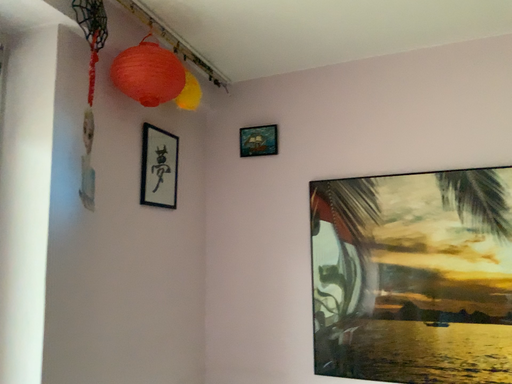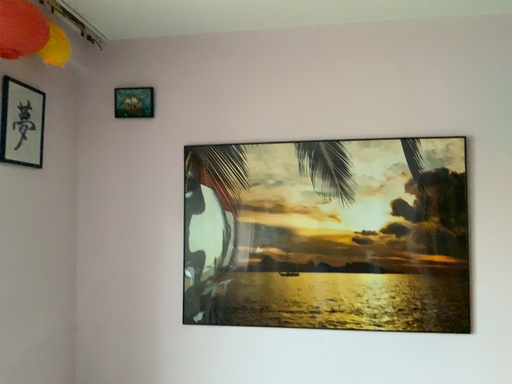
Question: How did the camera likely rotate when shooting the video?

Choices:
 (A) rotated left
 (B) rotated right

Answer: (B)